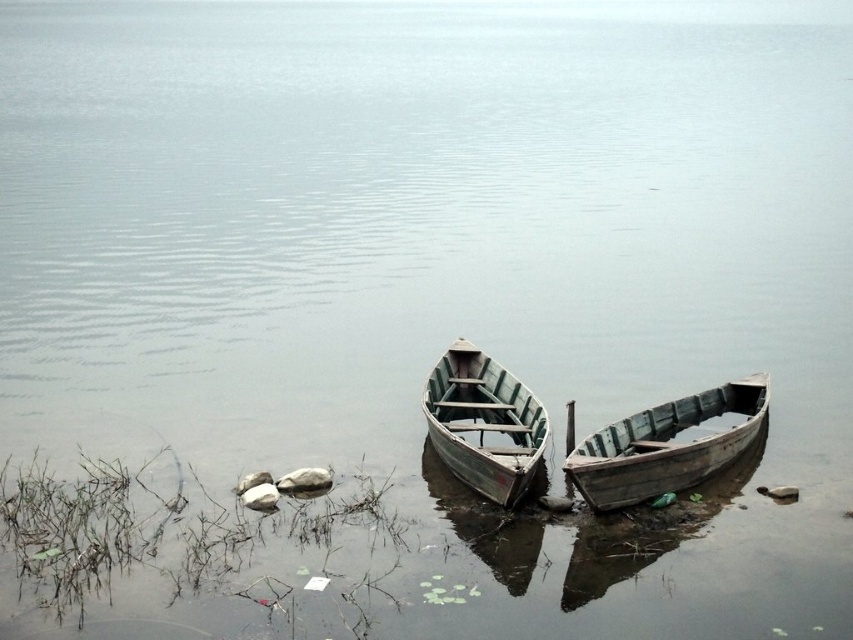
Question: Is the position of wooden canoe at lower right less distant than that of green wooden canoe at center?

Choices:
 (A) yes
 (B) no

Answer: (A)

Question: Is wooden canoe at lower right in front of green wooden canoe at center?

Choices:
 (A) yes
 (B) no

Answer: (A)

Question: Which of the following is the farthest from the observer?

Choices:
 (A) wooden canoe at lower right
 (B) green wooden canoe at center

Answer: (B)

Question: Among these objects, which one is farthest from the camera?

Choices:
 (A) wooden canoe at lower right
 (B) green wooden canoe at center

Answer: (B)

Question: Does wooden canoe at lower right appear on the left side of green wooden canoe at center?

Choices:
 (A) no
 (B) yes

Answer: (A)